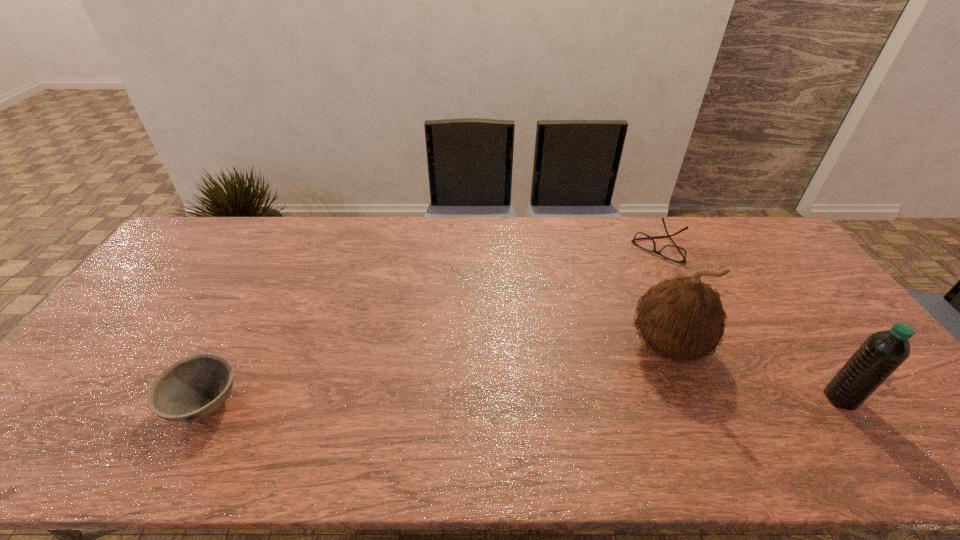
You are a GUI agent. You are given a task and a screenshot of the screen. Output one action in this format:
    pyautogui.click(x=<x>, y=<y>)
    Task: Click on the free space located on the surface of the coconut
    The image size is (960, 540).
    Given the screenshot: What is the action you would take?
    pyautogui.click(x=585, y=396)

You are a GUI agent. You are given a task and a screenshot of the screen. Output one action in this format:
    pyautogui.click(x=<x>, y=<y>)
    Task: Click on the vacant space located on the surface of the coconut
    The height and width of the screenshot is (540, 960).
    Given the screenshot: What is the action you would take?
    pyautogui.click(x=559, y=411)

The width and height of the screenshot is (960, 540). Find the location of `vacant space located 0.150m on the front-facing side of the spectacles`. vacant space located 0.150m on the front-facing side of the spectacles is located at coordinates (630, 284).

This screenshot has width=960, height=540. I want to click on vacant space situated on the front-facing side of the spectacles, so (608, 311).

Find the location of a particular element. The width and height of the screenshot is (960, 540). vacant region located on the front-facing side of the spectacles is located at coordinates (606, 313).

Identify the location of object that is at the far edge. (673, 252).

Locate an element on the screen. bowl positioned at the near edge is located at coordinates (194, 387).

I want to click on water bottle that is at the near edge, so click(883, 352).

Locate an element on the screen. This screenshot has width=960, height=540. object present at the right edge is located at coordinates (883, 352).

Locate an element on the screen. The height and width of the screenshot is (540, 960). object that is positioned at the near right corner is located at coordinates (883, 352).